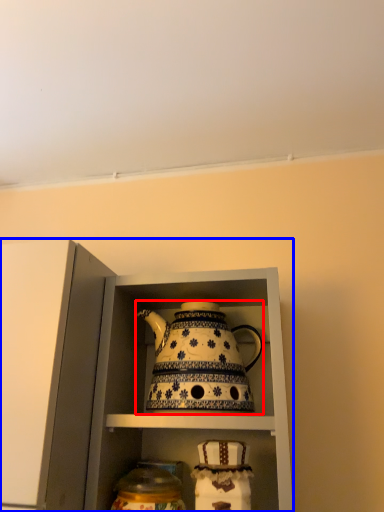
Question: Which of the following is the closest to the observer, kettle (highlighted by a red box) or cabinetry (highlighted by a blue box)?

Choices:
 (A) kettle
 (B) cabinetry

Answer: (B)